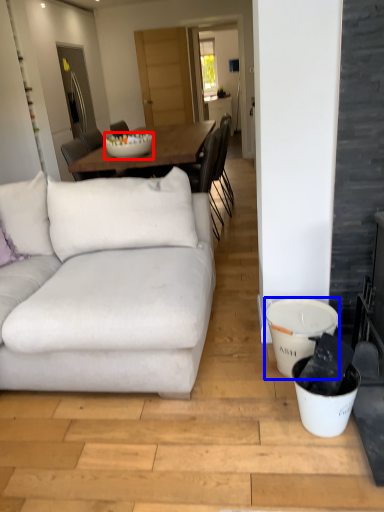
Question: Which of the following is the closest to the observer, bowl (highlighted by a red box) or bucket (highlighted by a blue box)?

Choices:
 (A) bowl
 (B) bucket

Answer: (B)